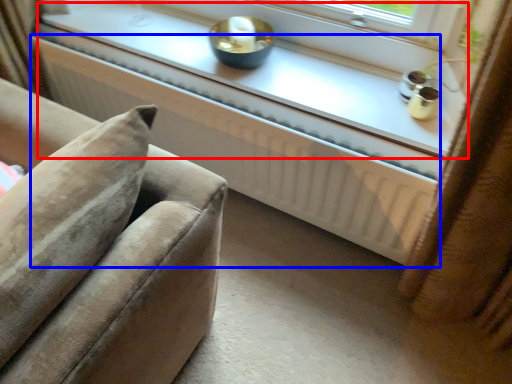
Question: Which object is further to the camera taking this photo, window sill (highlighted by a red box) or radiator (highlighted by a blue box)?

Choices:
 (A) window sill
 (B) radiator

Answer: (A)